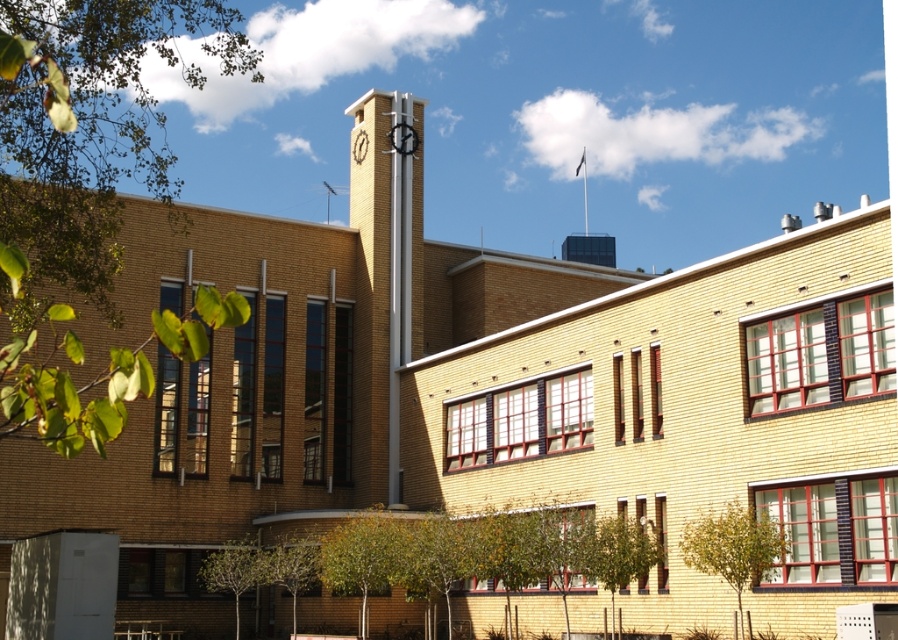
Question: Which point is farther to the camera?

Choices:
 (A) (405, 125)
 (B) (394, 422)

Answer: (A)

Question: Which object is closer to the camera taking this photo?

Choices:
 (A) white metallic clock at center
 (B) brick clock tower at center

Answer: (B)

Question: Estimate the real-world distances between objects in this image. Which object is closer to the black glossy clock at center?

Choices:
 (A) white metallic clock at center
 (B) brick clock tower at center

Answer: (B)

Question: Is brick clock tower at center smaller than black glossy clock at center?

Choices:
 (A) no
 (B) yes

Answer: (A)

Question: Is brick clock tower at center thinner than black glossy clock at center?

Choices:
 (A) yes
 (B) no

Answer: (B)

Question: Does black glossy clock at center appear over white metallic clock at center?

Choices:
 (A) no
 (B) yes

Answer: (A)